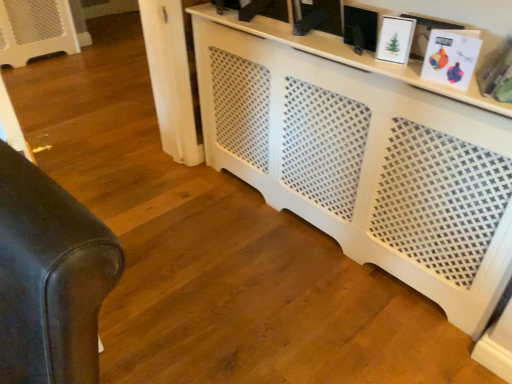
The width and height of the screenshot is (512, 384). I want to click on free region on the left part of white matte picture frame at upper right, the third picture frame from the left, so click(406, 72).